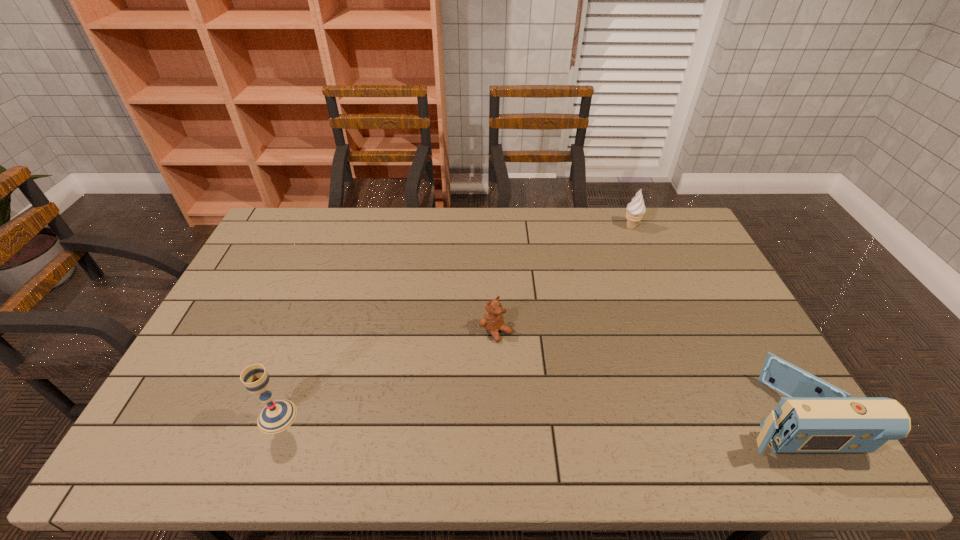
Where is `vacant region located on the front-facing side of the icecream`? This screenshot has width=960, height=540. vacant region located on the front-facing side of the icecream is located at coordinates (625, 250).

Where is `free space located 0.050m on the front-facing side of the icecream`? Image resolution: width=960 pixels, height=540 pixels. free space located 0.050m on the front-facing side of the icecream is located at coordinates (628, 240).

Image resolution: width=960 pixels, height=540 pixels. I want to click on vacant area situated on the front-facing side of the icecream, so click(624, 255).

Image resolution: width=960 pixels, height=540 pixels. Identify the location of object located in the far edge section of the desktop. (635, 209).

Find the location of `chalice that is positioned at the near edge`. chalice that is positioned at the near edge is located at coordinates (276, 416).

You are a GUI agent. You are given a task and a screenshot of the screen. Output one action in this format:
    pyautogui.click(x=<x>, y=<y>)
    Task: Click on the camcorder that is at the near edge
    Image resolution: width=960 pixels, height=540 pixels.
    Given the screenshot: What is the action you would take?
    pyautogui.click(x=816, y=417)

Locate an element on the screen. object located at the right edge is located at coordinates (816, 417).

The image size is (960, 540). What are the coordinates of `object present at the near right corner` in the screenshot? It's located at (816, 417).

Find the location of `vacant space at the far edge of the desktop`. vacant space at the far edge of the desktop is located at coordinates (478, 222).

In the image, there is a desktop. Where is `vacant space at the near edge`? vacant space at the near edge is located at coordinates (645, 406).